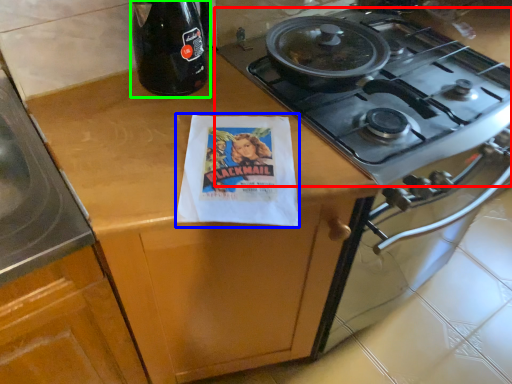
Question: Estimate the real-world distances between objects in this image. Which object is farther from gas stove (highlighted by a red box), flyer (highlighted by a blue box) or bottle (highlighted by a green box)?

Choices:
 (A) flyer
 (B) bottle

Answer: (B)